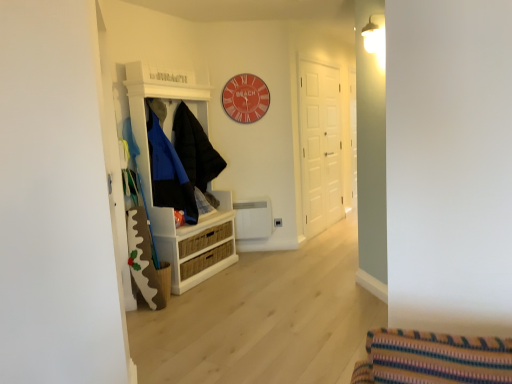
The height and width of the screenshot is (384, 512). What do you see at coordinates (195, 149) in the screenshot? I see `black puffy jacket at center, the 1th clothing positioned from the back` at bounding box center [195, 149].

Describe the element at coordinates (320, 145) in the screenshot. I see `white matte door at center` at that location.

Identify the location of matte black jacket at left, the first clothing when ordered from front to back. (169, 172).

What is the approximate width of matte black jacket at left, which ranks as the 2th clothing in back-to-front order?

The width of matte black jacket at left, which ranks as the 2th clothing in back-to-front order, is 48.93 centimeters.

The image size is (512, 384). Describe the element at coordinates (245, 98) in the screenshot. I see `matte red clock at upper center` at that location.

Find the location of a particular element. This screenshot has width=512, height=384. black puffy jacket at center, which appears as the second clothing when viewed from the front is located at coordinates (195, 149).

Who is smaller, white matte door at center or matte black jacket at left, the first clothing when ordered from front to back?

matte black jacket at left, the first clothing when ordered from front to back, is smaller.

Can you confirm if white matte door at center is taller than matte black jacket at left, which ranks as the 2th clothing in back-to-front order?

Yes, white matte door at center is taller than matte black jacket at left, which ranks as the 2th clothing in back-to-front order.

Based on the photo, is white matte door at center not near matte black jacket at left, the first clothing when ordered from front to back?

white matte door at center is positioned a significant distance from matte black jacket at left, the first clothing when ordered from front to back.

Is white matte door at center at the left side of matte black jacket at left, the first clothing when ordered from front to back?

Incorrect, white matte door at center is not on the left side of matte black jacket at left, the first clothing when ordered from front to back.

Considering their positions, is white wood cabinet at left located in front of or behind matte red clock at upper center?

Clearly, white wood cabinet at left is in front of matte red clock at upper center.

From the picture: Is matte red clock at upper center surrounded by white wood cabinet at left?

Actually, matte red clock at upper center is outside white wood cabinet at left.

From a real-world perspective, between white wood cabinet at left and matte red clock at upper center, who is vertically lower?

In real-world perspective, white wood cabinet at left is lower.

Where is `door lying below the matte red clock at upper center (from the image's perspective)`? The image size is (512, 384). door lying below the matte red clock at upper center (from the image's perspective) is located at coordinates (320, 145).

Could you tell me if matte red clock at upper center is turned towards white matte door at center?

No, matte red clock at upper center is not facing towards white matte door at center.

Is matte red clock at upper center not near white matte door at center?

Absolutely, matte red clock at upper center is distant from white matte door at center.

Is the depth of matte red clock at upper center less than that of white matte door at center?

Yes, matte red clock at upper center is in front of white matte door at center.

Does matte red clock at upper center contain matte black jacket at left, the first clothing when ordered from front to back?

No, matte black jacket at left, the first clothing when ordered from front to back, is located outside of matte red clock at upper center.

Considering the sizes of objects matte red clock at upper center and matte black jacket at left, which ranks as the 2th clothing in back-to-front order, in the image provided, who is smaller, matte red clock at upper center or matte black jacket at left, which ranks as the 2th clothing in back-to-front order,?

Smaller between the two is matte red clock at upper center.

Can you tell me how much black puffy jacket at center, which appears as the second clothing when viewed from the front, and white wood cabinet at left differ in facing direction?

The facing directions of black puffy jacket at center, which appears as the second clothing when viewed from the front, and white wood cabinet at left are 8.3e-05 degrees apart.

Who is taller, black puffy jacket at center, the 1th clothing positioned from the back, or white wood cabinet at left?

Standing taller between the two is white wood cabinet at left.

Is black puffy jacket at center, which appears as the second clothing when viewed from the front, bigger or smaller than white wood cabinet at left?

In the image, black puffy jacket at center, which appears as the second clothing when viewed from the front, appears to be smaller than white wood cabinet at left.

Does black puffy jacket at center, which appears as the second clothing when viewed from the front, have a greater width compared to white wood cabinet at left?

No.

Between matte black jacket at left, which ranks as the 2th clothing in back-to-front order, and white wood cabinet at left, which one appears on the right side from the viewer's perspective?

white wood cabinet at left is more to the right.

From the image's perspective, is matte black jacket at left, the first clothing when ordered from front to back, on top of white wood cabinet at left?

Correct, matte black jacket at left, the first clothing when ordered from front to back, appears higher than white wood cabinet at left in the image.

How many degrees apart are the facing directions of matte black jacket at left, the first clothing when ordered from front to back, and white wood cabinet at left?

They differ by 0.000317 degrees in their facing directions.

Based on the photo, from a real-world perspective, is matte black jacket at left, the first clothing when ordered from front to back, over white wood cabinet at left?

Yes, from a real-world perspective, matte black jacket at left, the first clothing when ordered from front to back, is on top of white wood cabinet at left.

Does black puffy jacket at center, the 1th clothing positioned from the back, lie behind matte black jacket at left, the first clothing when ordered from front to back?

Yes, it is.

How many degrees apart are the facing directions of black puffy jacket at center, the 1th clothing positioned from the back, and matte black jacket at left, the first clothing when ordered from front to back?

0.000266 degrees separate the facing orientations of black puffy jacket at center, the 1th clothing positioned from the back, and matte black jacket at left, the first clothing when ordered from front to back.

Is black puffy jacket at center, the 1th clothing positioned from the back, positioned far away from matte black jacket at left, which ranks as the 2th clothing in back-to-front order?

No, black puffy jacket at center, the 1th clothing positioned from the back, is not far away from matte black jacket at left, which ranks as the 2th clothing in back-to-front order.

Identify the location of clothing that is the 2nd object located in front of the white matte door at center. (169, 172).

The image size is (512, 384). I want to click on cabinetry below the matte red clock at upper center (from a real-world perspective), so point(151,171).

Based on their spatial positions, is black puffy jacket at center, the 1th clothing positioned from the back, or matte red clock at upper center further from white wood cabinet at left?

matte red clock at upper center lies further to white wood cabinet at left than the other object.

Based on their spatial positions, is black puffy jacket at center, the 1th clothing positioned from the back, or matte red clock at upper center closer to matte black jacket at left, which ranks as the 2th clothing in back-to-front order?

black puffy jacket at center, the 1th clothing positioned from the back, lies closer to matte black jacket at left, which ranks as the 2th clothing in back-to-front order, than the other object.

Considering their positions, is white matte door at center positioned further to white wood cabinet at left than matte red clock at upper center?

white matte door at center is positioned further to the anchor white wood cabinet at left.

When comparing their distances from white matte door at center, does matte red clock at upper center or black puffy jacket at center, which appears as the second clothing when viewed from the front, seem further?

Among the two, black puffy jacket at center, which appears as the second clothing when viewed from the front, is located further to white matte door at center.

Considering their positions, is white matte door at center positioned closer to matte black jacket at left, which ranks as the 2th clothing in back-to-front order, than white wood cabinet at left?

Based on the image, white wood cabinet at left appears to be nearer to matte black jacket at left, which ranks as the 2th clothing in back-to-front order.

Looking at the image, which one is located closer to black puffy jacket at center, which appears as the second clothing when viewed from the front, matte red clock at upper center or matte black jacket at left, the first clothing when ordered from front to back?

Among the two, matte black jacket at left, the first clothing when ordered from front to back, is located nearer to black puffy jacket at center, which appears as the second clothing when viewed from the front.

Looking at the image, which one is located further to white wood cabinet at left, matte red clock at upper center or black puffy jacket at center, the 1th clothing positioned from the back?

Among the two, matte red clock at upper center is located further to white wood cabinet at left.

Based on the photo, when comparing their distances from white wood cabinet at left, does matte black jacket at left, which ranks as the 2th clothing in back-to-front order, or white matte door at center seem further?

white matte door at center is further to white wood cabinet at left.

This screenshot has height=384, width=512. What are the coordinates of `clock situated between black puffy jacket at center, the 1th clothing positioned from the back, and white matte door at center from left to right` in the screenshot? It's located at (245, 98).

This screenshot has width=512, height=384. Find the location of `cabinetry between matte black jacket at left, which ranks as the 2th clothing in back-to-front order, and white matte door at center, in the horizontal direction`. cabinetry between matte black jacket at left, which ranks as the 2th clothing in back-to-front order, and white matte door at center, in the horizontal direction is located at coordinates (151, 171).

Where is `clothing between matte black jacket at left, the first clothing when ordered from front to back, and matte red clock at upper center in the front-back direction`? The image size is (512, 384). clothing between matte black jacket at left, the first clothing when ordered from front to back, and matte red clock at upper center in the front-back direction is located at coordinates (195, 149).

This screenshot has height=384, width=512. Find the location of `clothing located between matte black jacket at left, the first clothing when ordered from front to back, and white matte door at center in the left-right direction`. clothing located between matte black jacket at left, the first clothing when ordered from front to back, and white matte door at center in the left-right direction is located at coordinates (195, 149).